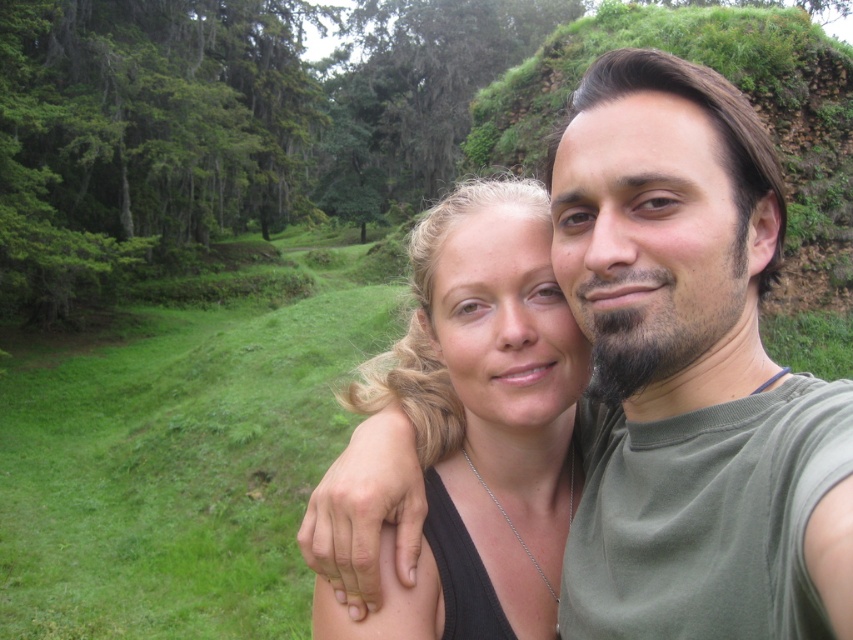
You are a photographer trying to capture the perfect selfie. You notice the matte green shirt at center and the black matte hair at center. Which object would you adjust to ensure proper framing if you want the thinner object to be more prominent?

Since the matte green shirt at center is thinner than the black matte hair at center, you should adjust the matte green shirt at center to be more prominent in the frame.

You are a photographer trying to adjust the lighting for a portrait. You notice the matte green shirt at center and the black matte hair at center. Which object is located to the right when viewed from the photographer perspective?

The matte green shirt at center is positioned on the right side of black matte hair at center, so the matte green shirt at center is to the right.